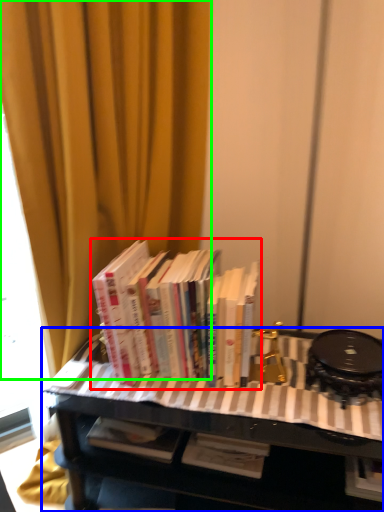
Question: Which object is the farthest from book (highlighted by a red box)? Choose among these: table (highlighted by a blue box) or curtain (highlighted by a green box).

Choices:
 (A) table
 (B) curtain

Answer: (B)